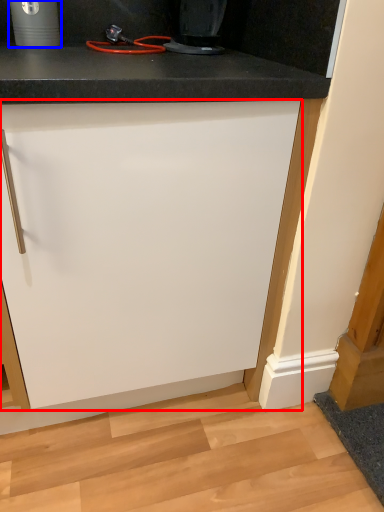
Question: Which object appears closest to the camera in this image, cabinetry (highlighted by a red box) or appliance (highlighted by a blue box)?

Choices:
 (A) cabinetry
 (B) appliance

Answer: (A)